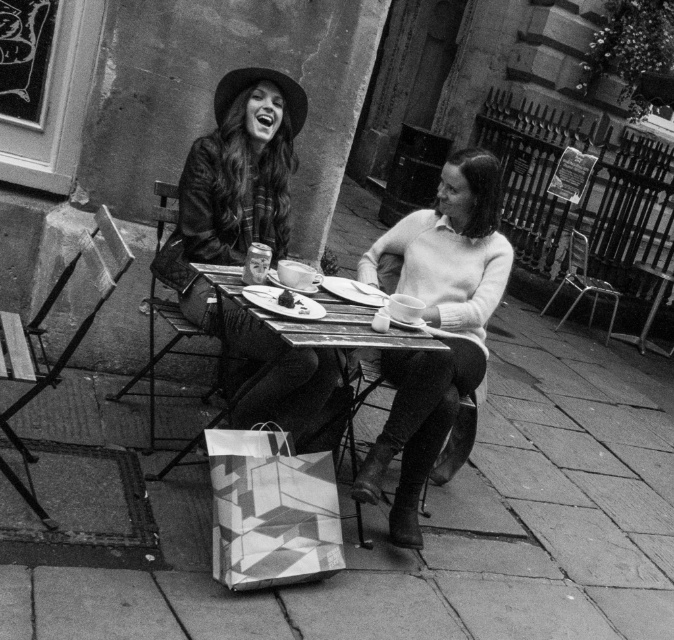
Is point (239, 508) more distant than point (275, 355)?

No, it is not.

Which is more to the left, geometric-patterned paper bag at lower center or wooden table at center?

geometric-patterned paper bag at lower center

I want to click on geometric-patterned paper bag at lower center, so click(270, 509).

Locate an element on the screen. geometric-patterned paper bag at lower center is located at coordinates (270, 509).

Which is more to the left, knitted sweater at center or wooden table at center?

wooden table at center is more to the left.

Which is above, knitted sweater at center or wooden table at center?

knitted sweater at center is higher up.

Between point (452, 253) and point (295, 372), which one is positioned behind?

The point (452, 253) is behind.

I want to click on knitted sweater at center, so click(x=435, y=324).

Consider the image. Is knitted sweater at center smaller than geometric-patterned paper bag at lower center?

No, knitted sweater at center is not smaller than geometric-patterned paper bag at lower center.

Does knitted sweater at center have a lesser height compared to geometric-patterned paper bag at lower center?

In fact, knitted sweater at center may be taller than geometric-patterned paper bag at lower center.

Between point (429, 216) and point (337, 528), which one is positioned in front?

Point (337, 528) is in front.

You are a GUI agent. You are given a task and a screenshot of the screen. Output one action in this format:
    pyautogui.click(x=<x>, y=<y>)
    Task: Click on the knitted sweater at center
    This screenshot has height=640, width=674.
    Given the screenshot: What is the action you would take?
    pyautogui.click(x=435, y=324)